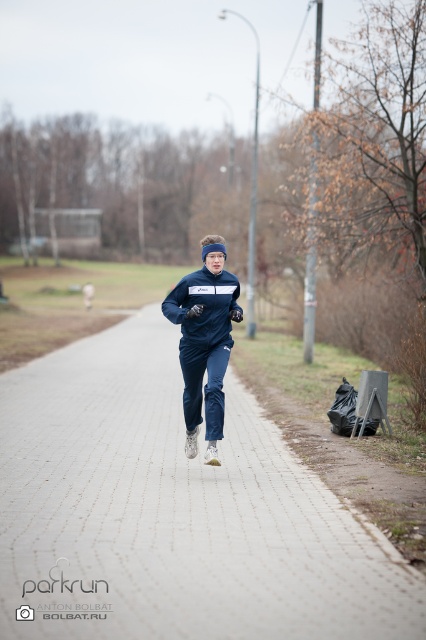
Question: Can you confirm if gray brick pavement at center is positioned to the right of navy blue tracksuit at center?

Choices:
 (A) no
 (B) yes

Answer: (A)

Question: Does gray brick pavement at center lie in front of navy blue fleece sweatshirt at center?

Choices:
 (A) yes
 (B) no

Answer: (A)

Question: Which of the following is the closest to the observer?

Choices:
 (A) navy blue tracksuit at center
 (B) gray brick pavement at center
 (C) navy blue fleece sweatshirt at center

Answer: (B)

Question: Does gray brick pavement at center appear over navy blue fleece sweatshirt at center?

Choices:
 (A) yes
 (B) no

Answer: (B)

Question: Considering the real-world distances, which object is farthest from the navy blue fleece sweatshirt at center?

Choices:
 (A) gray brick pavement at center
 (B) navy blue tracksuit at center

Answer: (A)

Question: Among these objects, which one is nearest to the camera?

Choices:
 (A) navy blue tracksuit at center
 (B) navy blue fleece sweatshirt at center
 (C) gray brick pavement at center

Answer: (C)